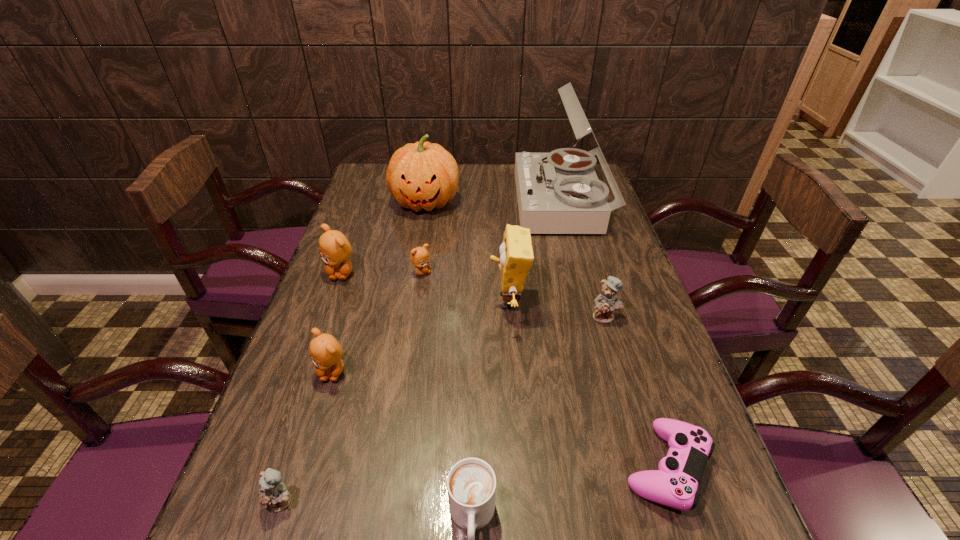
Identify the location of vacant space located on the face of the eighth shortest object. The width and height of the screenshot is (960, 540). [x=423, y=301].

Locate an element on the screen. Image resolution: width=960 pixels, height=540 pixels. vacant space located 0.370m on the face of the eighth shortest object is located at coordinates (345, 301).

Locate an element on the screen. vacant space located 0.230m on the face of the biggest brown teddy bear is located at coordinates 313,350.

Locate an element on the screen. The height and width of the screenshot is (540, 960). free location located on the front-facing side of the rightmost teddy bear is located at coordinates (632, 408).

Identify the location of free point located 0.270m on the face of the fourth farthest teddy bear. 287,521.

Where is `blank area located 0.390m on the face of the rightmost brown teddy bear`? The image size is (960, 540). blank area located 0.390m on the face of the rightmost brown teddy bear is located at coordinates (572, 272).

The image size is (960, 540). In order to click on vacant space situated 0.180m on the back of the pink control in this screenshot , I will do `click(630, 353)`.

At what (x,y) coordinates should I click in order to perform the action: click on record player present at the far edge. Please return your answer as a coordinate pair (x, y). The image size is (960, 540). Looking at the image, I should click on (559, 192).

In order to click on pumpkin that is at the far edge in this screenshot , I will do `click(424, 175)`.

This screenshot has height=540, width=960. What are the coordinates of `pumpkin that is positioned at the left edge` in the screenshot? It's located at (424, 175).